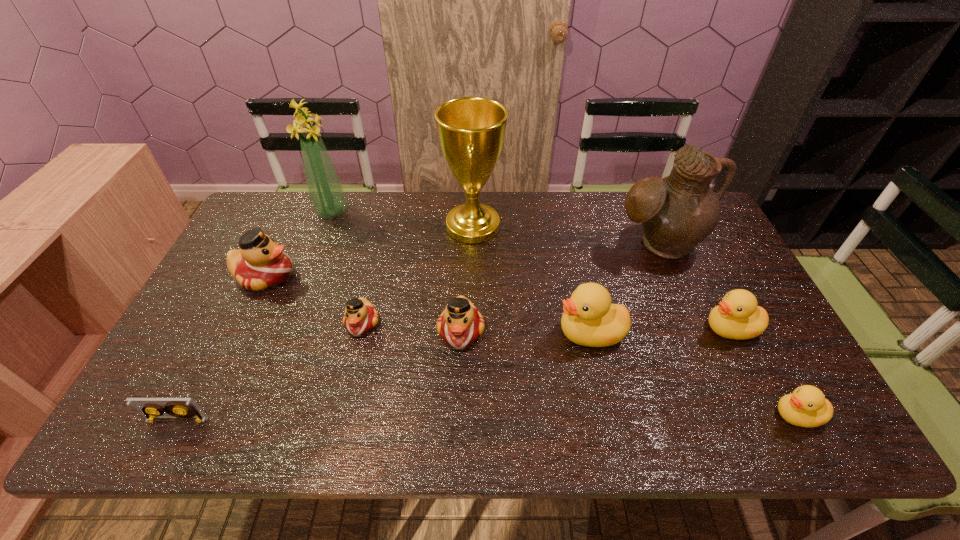
This screenshot has width=960, height=540. Identify the location of duck that is the closest one to the gold award. (460, 324).

Point out which red duck is positioned as the second nearest to the leftmost red duck. Please provide its 2D coordinates. Your answer should be formatted as a tuple, i.e. [(x, y)], where the tuple contains the x and y coordinates of a point satisfying the conditions above.

[(460, 324)]

Select which red duck appears as the closest to the rightmost red duck. Please provide its 2D coordinates. Your answer should be formatted as a tuple, i.e. [(x, y)], where the tuple contains the x and y coordinates of a point satisfying the conditions above.

[(360, 316)]

Locate which yellow duck is the closest to the leftmost duck. Please provide its 2D coordinates. Your answer should be formatted as a tuple, i.e. [(x, y)], where the tuple contains the x and y coordinates of a point satisfying the conditions above.

[(589, 319)]

This screenshot has height=540, width=960. Find the location of `the second closest yellow duck to the bouquet`. the second closest yellow duck to the bouquet is located at coordinates (738, 317).

What are the coordinates of `free spot that satisfies the following two spatial constraints: 1. on the front-facing side of the green bouquet; 2. at the front of the brown videotape with visible reels` in the screenshot? It's located at tap(252, 420).

Where is `free spot that satisfies the following two spatial constraints: 1. on the front-facing side of the green bouquet; 2. at the front of the videotape with visible reels`? The width and height of the screenshot is (960, 540). free spot that satisfies the following two spatial constraints: 1. on the front-facing side of the green bouquet; 2. at the front of the videotape with visible reels is located at coordinates (252, 420).

You are a GUI agent. You are given a task and a screenshot of the screen. Output one action in this format:
    pyautogui.click(x=<x>, y=<y>)
    Task: Click on the vacant space that satisfies the following two spatial constraints: 1. at the beak of the nearest duck; 2. at the front of the videotape with visible reels
    The image size is (960, 540).
    Given the screenshot: What is the action you would take?
    pyautogui.click(x=800, y=420)